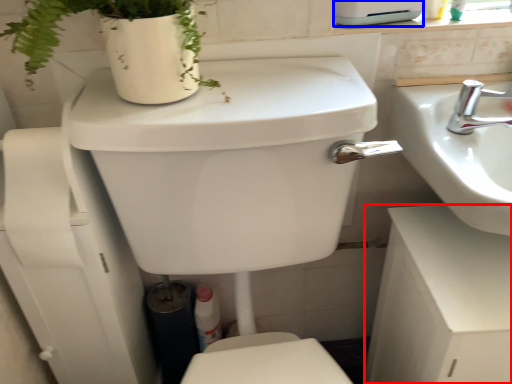
Question: Which object appears farthest to the camera in this image, counter top (highlighted by a red box) or appliance (highlighted by a blue box)?

Choices:
 (A) counter top
 (B) appliance

Answer: (B)